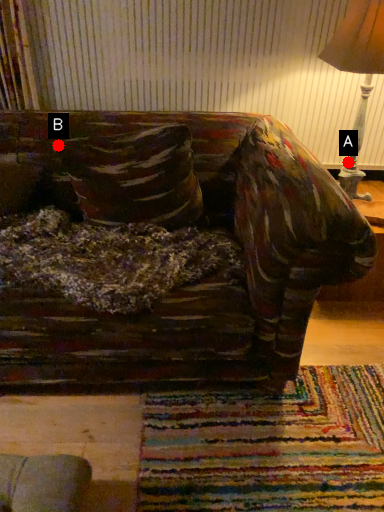
Question: Two points are circled on the image, labeled by A and B beside each circle. Which point is further to the camera?

Choices:
 (A) A is further
 (B) B is further

Answer: (A)